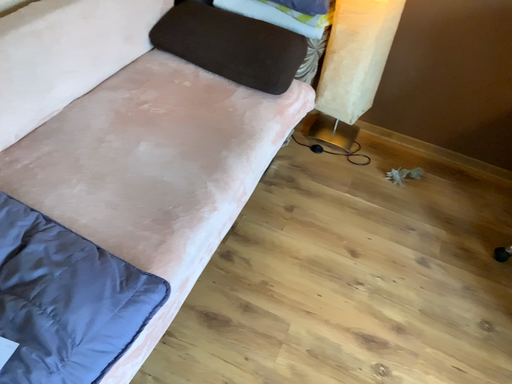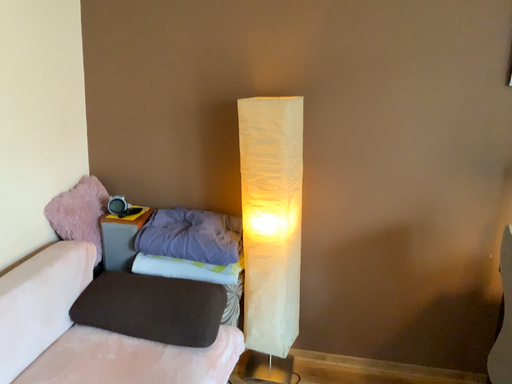
Question: How did the camera likely rotate when shooting the video?

Choices:
 (A) rotated left
 (B) rotated right

Answer: (B)